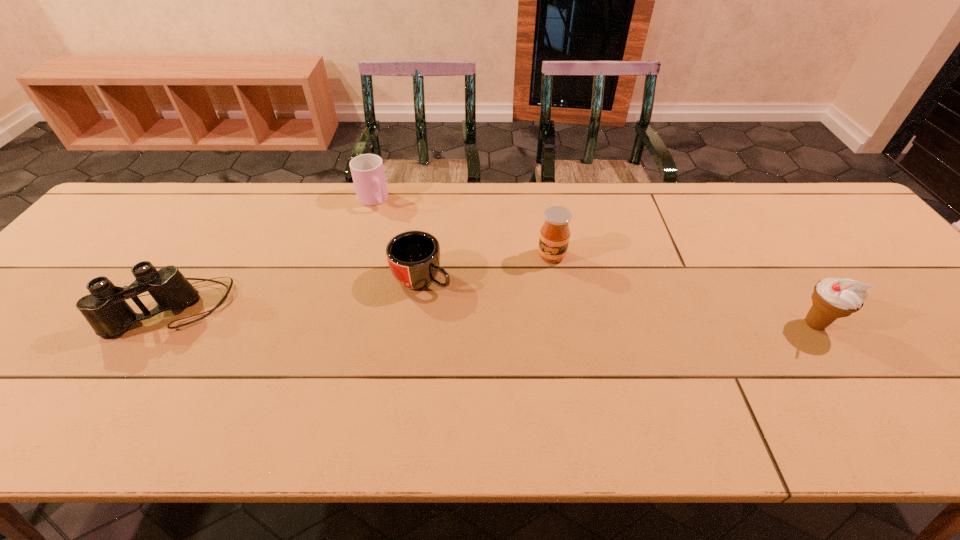
I want to click on binoculars, so click(105, 309).

Find the location of a particular element. The width and height of the screenshot is (960, 540). icecream is located at coordinates (833, 298).

The height and width of the screenshot is (540, 960). What are the coordinates of `mug` in the screenshot? It's located at (413, 256).

You are a GUI agent. You are given a task and a screenshot of the screen. Output one action in this format:
    pyautogui.click(x=<x>, y=<y>)
    Task: Click on the shortest object
    
    Given the screenshot: What is the action you would take?
    pyautogui.click(x=413, y=256)

Identify the location of the second object from left to right. The image size is (960, 540). (367, 170).

At what (x,y) coordinates should I click in order to perform the action: click on cup. Please return your answer as a coordinate pair (x, y). This screenshot has width=960, height=540. Looking at the image, I should click on (367, 170).

Identify the location of the second object from right to left. This screenshot has height=540, width=960. (554, 237).

Find the location of a particular element. This screenshot has height=540, width=960. vacant space located 0.300m on the right of the binoculars is located at coordinates (350, 308).

I want to click on vacant space located on the back of the icecream, so [758, 240].

Where is `vacant space located on the side of the mug with the handle`? The height and width of the screenshot is (540, 960). vacant space located on the side of the mug with the handle is located at coordinates (583, 367).